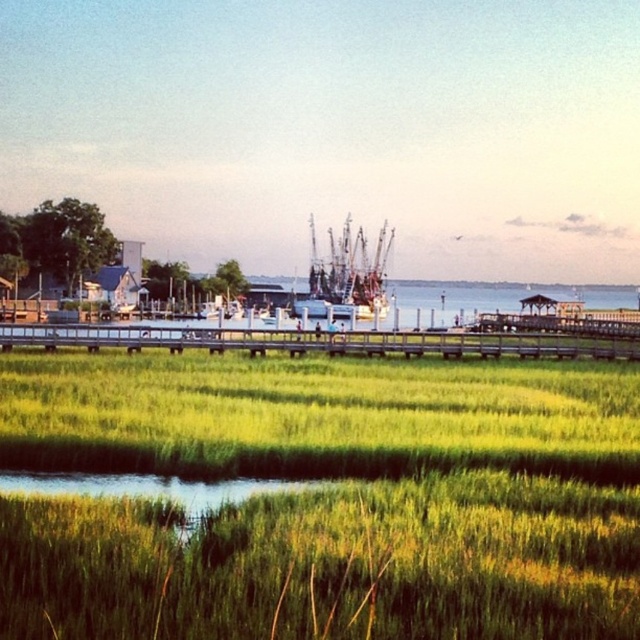
Question: Which point is farther from the camera taking this photo?

Choices:
 (A) (330, 280)
 (B) (278, 339)

Answer: (A)

Question: Can you confirm if wooden at center is positioned below shiny metallic boat at center?

Choices:
 (A) no
 (B) yes

Answer: (B)

Question: Can you confirm if green grassy at center is positioned to the left of shiny metallic boat at center?

Choices:
 (A) no
 (B) yes

Answer: (B)

Question: Which object is closer to the camera taking this photo?

Choices:
 (A) shiny metallic boat at center
 (B) green grassy at center

Answer: (B)

Question: Can you confirm if green grassy at center is positioned above shiny metallic boat at center?

Choices:
 (A) yes
 (B) no

Answer: (B)

Question: Which point is closer to the camera?

Choices:
 (A) green grassy at center
 (B) wooden at center
 (C) shiny metallic boat at center

Answer: (A)